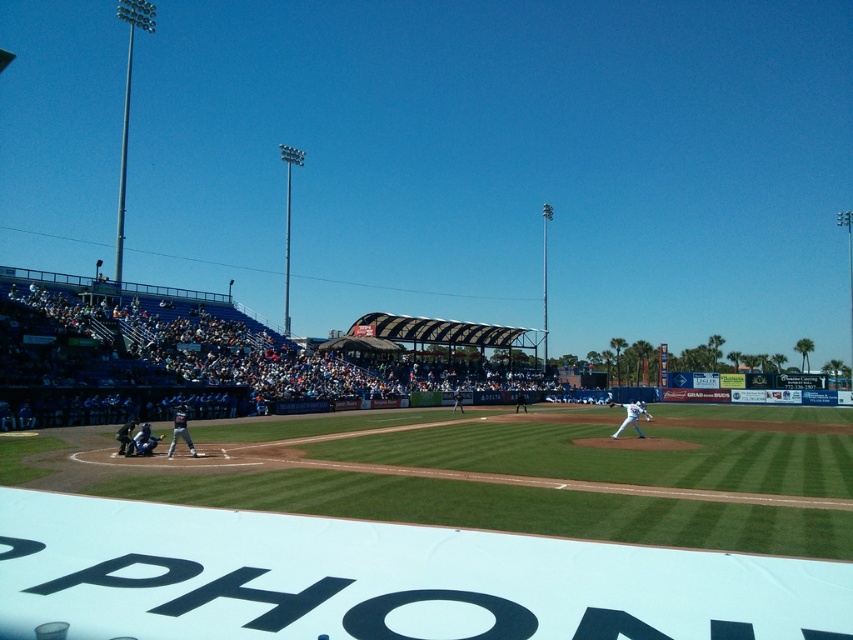
Looking at this image, does brown leather glove at center have a larger size compared to brown leather glove at lower left?

Actually, brown leather glove at center might be smaller than brown leather glove at lower left.

Does point (608, 406) come closer to viewer compared to point (160, 435)?

No, (608, 406) is further to viewer.

Is point (612, 401) farther from viewer compared to point (164, 436)?

Yes, point (612, 401) is farther from viewer.

Identify the location of brown leather glove at center. Image resolution: width=853 pixels, height=640 pixels. (610, 403).

Who is lower down, white matte baseball bat at center or brown leather glove at lower left?

white matte baseball bat at center is lower down.

Based on the photo, is white matte baseball bat at center thinner than brown leather glove at lower left?

In fact, white matte baseball bat at center might be wider than brown leather glove at lower left.

The image size is (853, 640). What do you see at coordinates (631, 417) in the screenshot? I see `white matte baseball bat at center` at bounding box center [631, 417].

Identify the location of white matte baseball bat at center. (631, 417).

Between point (512, 490) and point (627, 419), which one is positioned in front?

Point (512, 490) is more forward.

Is point (387, 476) positioned behind point (619, 426)?

No, (387, 476) is in front of (619, 426).

Where is `green grass field at center`? Image resolution: width=853 pixels, height=640 pixels. green grass field at center is located at coordinates (503, 472).

The image size is (853, 640). Identify the location of green grass field at center. (503, 472).